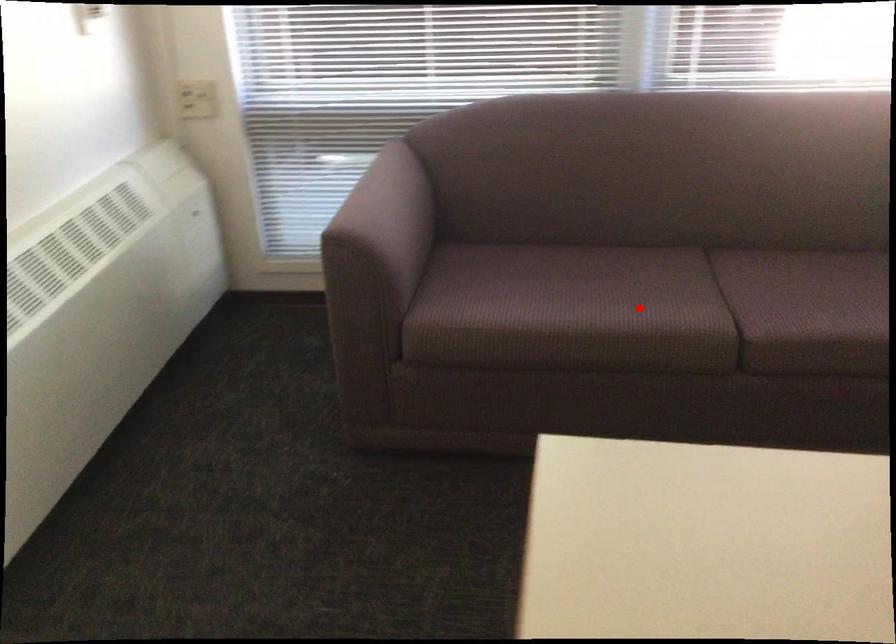
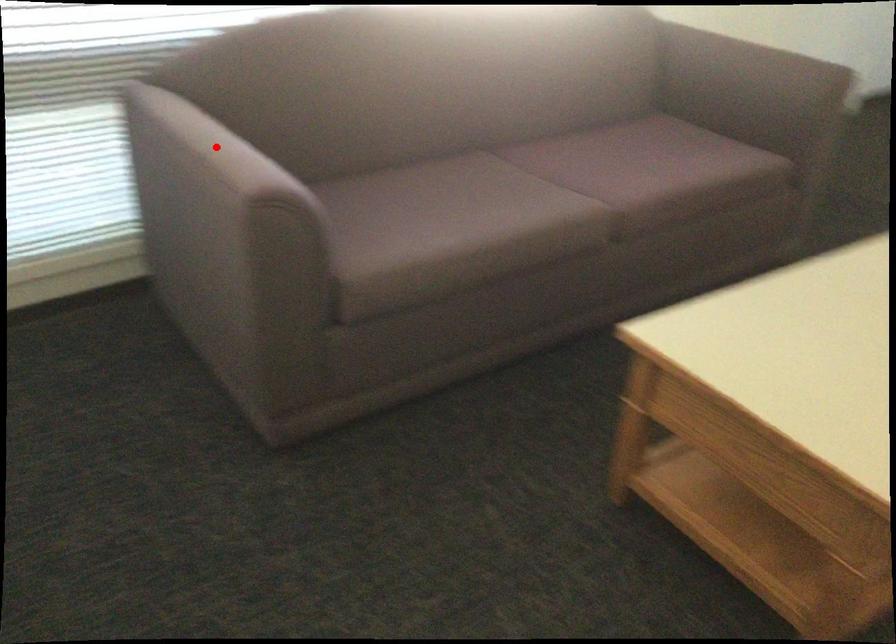
From the picture: I am providing you with two images of the same scene from different viewpoints. A red point is marked on the first image and another point is marked on the second image. Are the points marked in image1 and image2 representing the same 3D position?

No